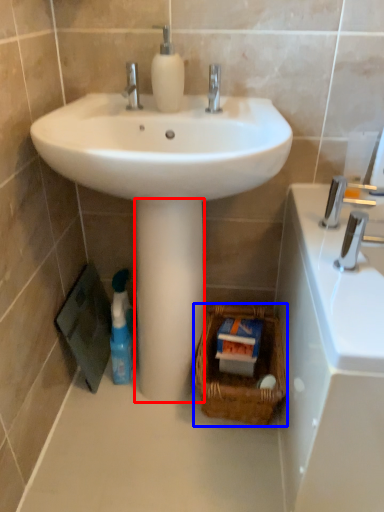
Question: Which object is closer to the camera taking this photo, pillar (highlighted by a red box) or basket (highlighted by a blue box)?

Choices:
 (A) pillar
 (B) basket

Answer: (A)